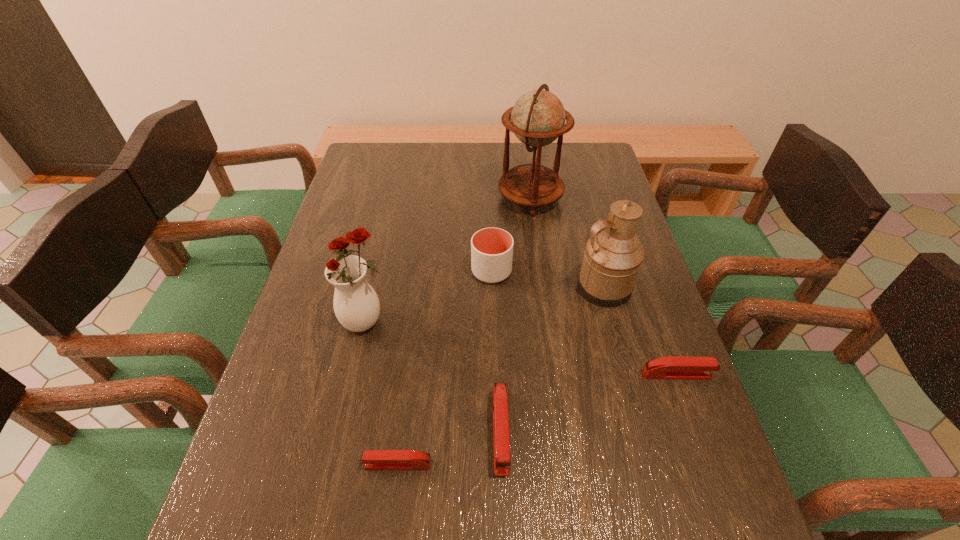
The height and width of the screenshot is (540, 960). What are the coordinates of `free region located 0.130m on the front-facing side of the leftmost stapler` in the screenshot? It's located at (296, 464).

Image resolution: width=960 pixels, height=540 pixels. Identify the location of vacant point located on the front-facing side of the leftmost stapler. (264, 464).

Locate an element on the screen. Image resolution: width=960 pixels, height=540 pixels. vacant region located 0.110m on the surface of the farthest object is located at coordinates (464, 198).

Locate an element on the screen. The width and height of the screenshot is (960, 540). free spot located on the surface of the farthest object is located at coordinates 398,198.

The height and width of the screenshot is (540, 960). I want to click on blank space located 0.190m on the surface of the farthest object, so click(x=439, y=198).

I want to click on free space located 0.080m on the left of the vase, so click(307, 322).

Locate an element on the screen. vacant space located 0.090m on the back of the cup is located at coordinates (491, 236).

Find the location of a particular element. The image size is (960, 540). vacant space located 0.140m on the front of the pitcher is located at coordinates (621, 355).

Identify the location of object at the left edge. (356, 305).

At what (x,y) coordinates should I click in order to perform the action: click on stapler that is positioned at the right edge. Please return your answer as a coordinate pair (x, y). This screenshot has width=960, height=540. Looking at the image, I should click on (672, 367).